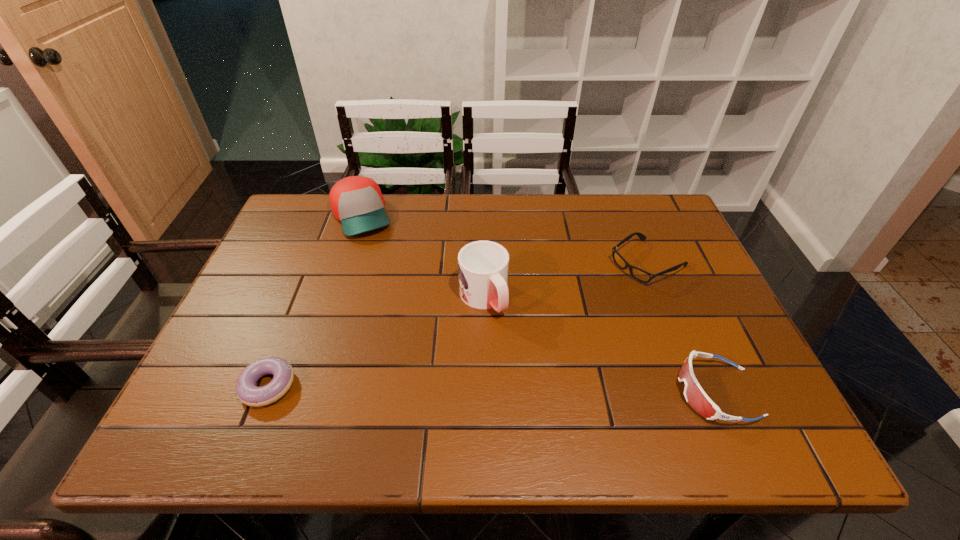
Identify the location of unoccupied position between the third object from left to right and the baseball cap. (422, 257).

The image size is (960, 540). Identify the location of blank region between the tallest object and the spectacles. (565, 280).

At what (x,y) coordinates should I click in order to perform the action: click on free space between the second shortest object and the baseball cap. Please return your answer as a coordinate pair (x, y). This screenshot has width=960, height=540. Looking at the image, I should click on (505, 239).

This screenshot has width=960, height=540. In order to click on free space between the baseball cap and the tallest object in this screenshot , I will do `click(422, 257)`.

Find the location of a particular element. This screenshot has height=540, width=960. free space between the second shortest object and the baseball cap is located at coordinates (505, 239).

Image resolution: width=960 pixels, height=540 pixels. What are the coordinates of `free spot between the second shortest object and the tallest object` in the screenshot? It's located at (565, 280).

Locate an element on the screen. the third closest object to the shortest object is located at coordinates (643, 276).

Locate which object is the fourth closest to the mug. Please provide its 2D coordinates. Your answer should be formatted as a tuple, i.e. [(x, y)], where the tuple contains the x and y coordinates of a point satisfying the conditions above.

[(695, 396)]

Identify the location of vacant space that satisfies the following two spatial constraints: 1. on the front side of the third shortest object; 2. on the front-facing side of the second shortest object. (701, 392).

The height and width of the screenshot is (540, 960). Identify the location of vacant position in the image that satisfies the following two spatial constraints: 1. on the front side of the goggles; 2. on the front-facing side of the shortest object. (265, 392).